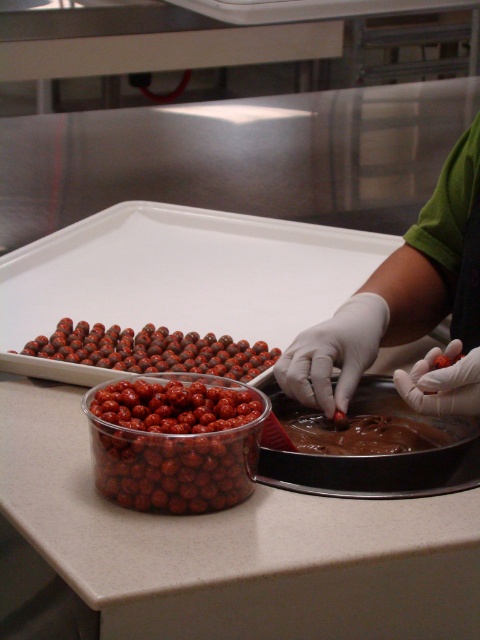
From the picture: You are a quality inspector standing 30 inches away from the shiny red chocolate at center. Can you reach it without moving your position?

The shiny red chocolate at center is 27.53 inches away from the camera, so yes, you can reach it from your current position since you are only 30 inches away.